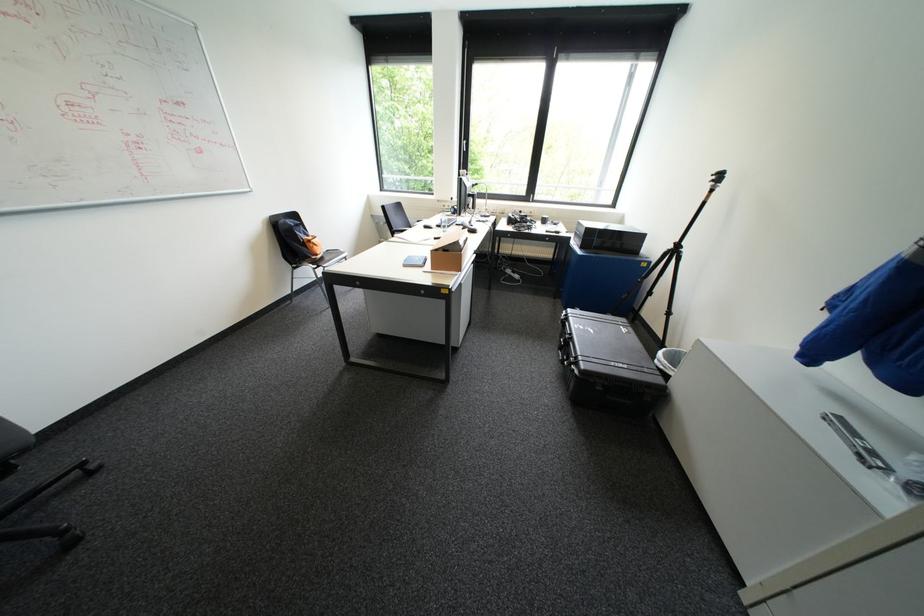
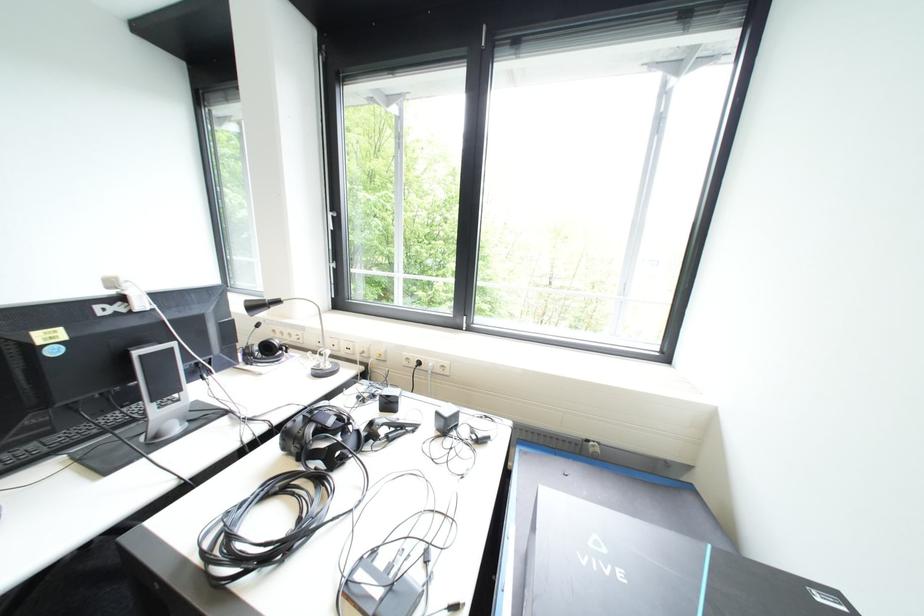
In a continuous first-person perspective shot, in which direction is the camera moving?

The cameraman moved toward right, forward.